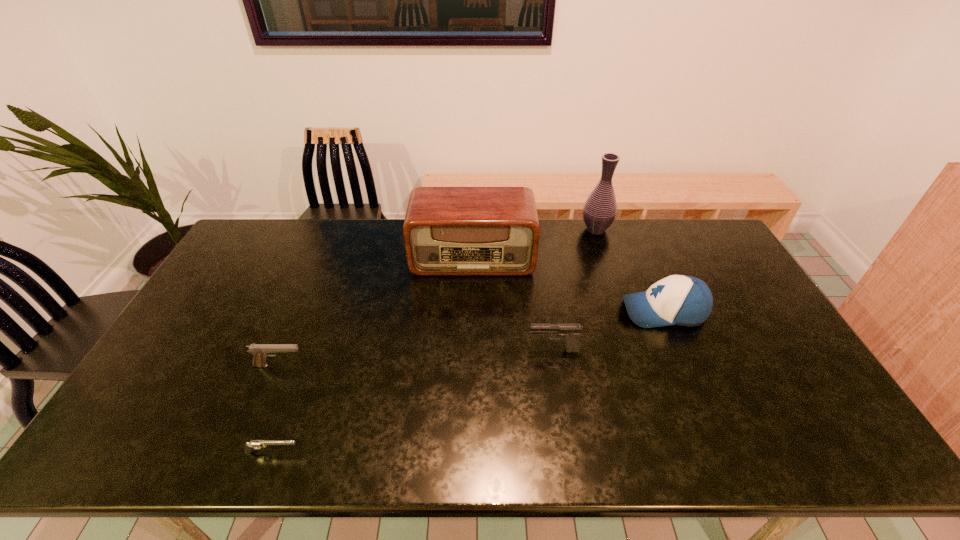
This screenshot has height=540, width=960. Identify the location of vacant region at the near left corner of the desktop. (101, 450).

Identify the location of vacant space at the far right corner of the desktop. The image size is (960, 540). [x=665, y=220].

Find the location of a particular element. free space at the near right corner of the desktop is located at coordinates (813, 427).

This screenshot has width=960, height=540. What are the coordinates of `unoccupied position between the tallest pistol and the baseball cap` in the screenshot? It's located at (609, 331).

This screenshot has width=960, height=540. Find the location of `free space between the third shortest object and the second farthest object`. free space between the third shortest object and the second farthest object is located at coordinates (513, 303).

The image size is (960, 540). In order to click on free space between the second farthest pistol and the radio receiver in this screenshot , I will do click(x=375, y=311).

Find the location of `free space that is in between the fifth nearest object and the farthest pistol`. free space that is in between the fifth nearest object and the farthest pistol is located at coordinates (513, 303).

You are a GUI agent. You are given a task and a screenshot of the screen. Output one action in this format:
    pyautogui.click(x=<x>, y=<y>)
    Task: Click on the free space between the shortest object and the fourth tallest object
    
    Given the screenshot: What is the action you would take?
    pyautogui.click(x=413, y=401)

Find the location of `free area in between the second farthest pistol and the third tallest object`. free area in between the second farthest pistol and the third tallest object is located at coordinates (471, 339).

Where is `blank region between the third farthest object and the tallest pistol`? blank region between the third farthest object and the tallest pistol is located at coordinates (609, 331).